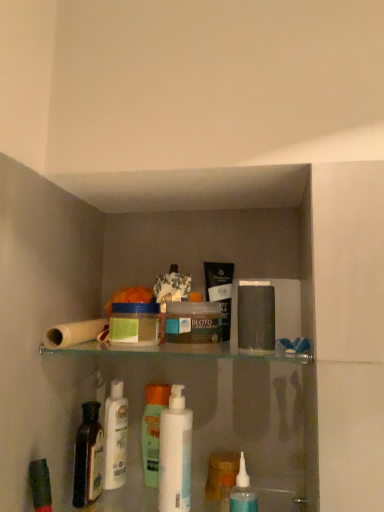
Question: From a real-world perspective, is translucent plastic container at center, which is counted as the second product, starting from the left, located higher than white glossy mouthwash at center, acting as the first mouthwash starting from the left?

Choices:
 (A) yes
 (B) no

Answer: (A)

Question: Can you confirm if translucent plastic container at center, the 1th product when ordered from right to left, is positioned to the right of white glossy mouthwash at center, the 2th mouthwash positioned from the front?

Choices:
 (A) yes
 (B) no

Answer: (A)

Question: Considering the relative sizes of translucent plastic container at center, which is counted as the second product, starting from the left, and white glossy mouthwash at center, marked as the second mouthwash in a right-to-left arrangement, in the image provided, is translucent plastic container at center, which is counted as the second product, starting from the left, taller than white glossy mouthwash at center, marked as the second mouthwash in a right-to-left arrangement,?

Choices:
 (A) yes
 (B) no

Answer: (B)

Question: Is translucent plastic container at center, the 1th product when ordered from right to left, positioned beyond the bounds of white glossy mouthwash at center, the 2th mouthwash positioned from the front?

Choices:
 (A) no
 (B) yes

Answer: (B)

Question: Is translucent plastic container at center, the 1th product when ordered from right to left, facing away from white glossy mouthwash at center, marked as the second mouthwash in a right-to-left arrangement?

Choices:
 (A) yes
 (B) no

Answer: (B)

Question: Is dark brown glass bottle at lower left in front of or behind translucent plastic container at center, which is counted as the second product, starting from the left, in the image?

Choices:
 (A) behind
 (B) front

Answer: (A)

Question: From a real-world perspective, is dark brown glass bottle at lower left positioned above or below translucent plastic container at center, which is counted as the second product, starting from the left?

Choices:
 (A) above
 (B) below

Answer: (B)

Question: Looking at their shapes, would you say dark brown glass bottle at lower left is wider or thinner than translucent plastic container at center, which is counted as the second product, starting from the left?

Choices:
 (A) thin
 (B) wide

Answer: (A)

Question: In terms of size, does dark brown glass bottle at lower left appear bigger or smaller than translucent plastic container at center, the 1th product when ordered from right to left?

Choices:
 (A) small
 (B) big

Answer: (A)

Question: Is green matte jar at center, which appears as the 2th product when viewed from the right, to the left or to the right of white matte toilet paper at left in the image?

Choices:
 (A) left
 (B) right

Answer: (B)

Question: In the image, is green matte jar at center, the 1th product in the left-to-right sequence, positioned in front of or behind white matte toilet paper at left?

Choices:
 (A) behind
 (B) front

Answer: (B)

Question: Considering the positions of green matte jar at center, which appears as the 2th product when viewed from the right, and white matte toilet paper at left in the image, is green matte jar at center, which appears as the 2th product when viewed from the right, bigger or smaller than white matte toilet paper at left?

Choices:
 (A) big
 (B) small

Answer: (A)

Question: From the image's perspective, is green matte jar at center, the 1th product in the left-to-right sequence, above or below white matte toilet paper at left?

Choices:
 (A) above
 (B) below

Answer: (A)

Question: Is translucent plastic bottle at center, positioned as the 1th toiletry in back-to-front order, bigger or smaller than white glossy mouthwash at center, the 2th mouthwash positioned from the front?

Choices:
 (A) big
 (B) small

Answer: (B)

Question: Considering the relative positions of translucent plastic bottle at center, the 2th toiletry in the right-to-left sequence, and white glossy mouthwash at center, which is the first mouthwash from back to front, in the image provided, is translucent plastic bottle at center, the 2th toiletry in the right-to-left sequence, to the left or to the right of white glossy mouthwash at center, which is the first mouthwash from back to front,?

Choices:
 (A) left
 (B) right

Answer: (A)